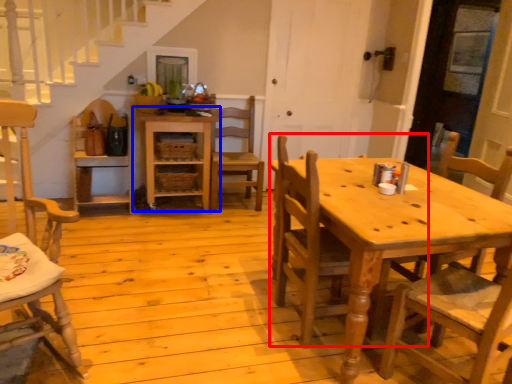
Question: Among these objects, which one is farthest to the camera, chair (highlighted by a red box) or shelf (highlighted by a blue box)?

Choices:
 (A) chair
 (B) shelf

Answer: (B)